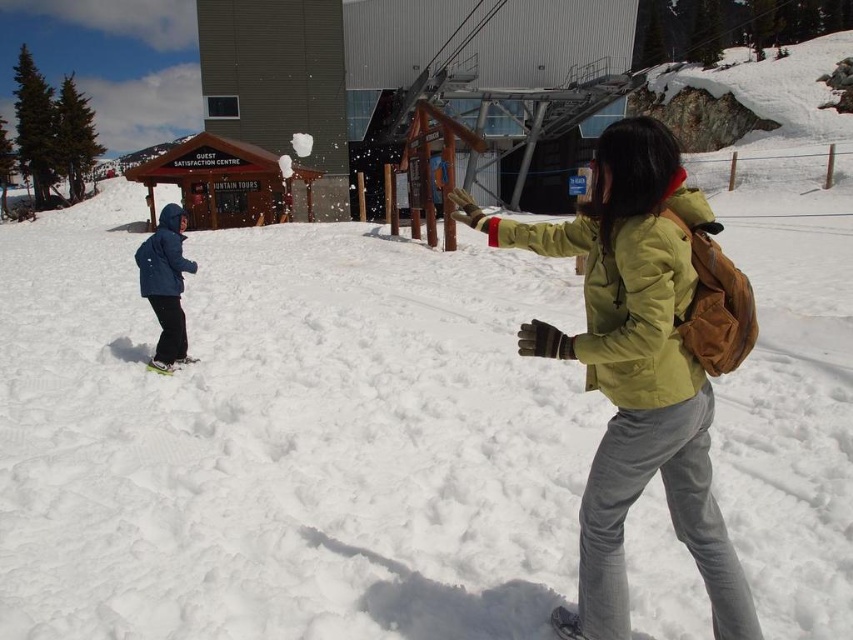
From the picture: You are a delivery robot with a 24 inch wide package. You need to navigate between the dark blue fabric jacket at left and the green plastic snowboard at left. Can you fit through the space between them?

The dark blue fabric jacket at left is 24.37 inches away from the green plastic snowboard at left. Since the package is 24 inches wide, it should fit through the space between them as there is enough clearance.

You are standing at the point marked by the coordinates point (283, 436) in the image. What is the terrain like under your feet?

The terrain under your feet at point (283, 436) is white snow at center.

You are a photographer trying to capture a clear shot of the white snow at center and the matte green jacket at center. Which object should you focus on first to ensure both are in focus?

The matte green jacket at center is behind the white snow at center, so you should focus on the matte green jacket at center first to ensure both are in focus.